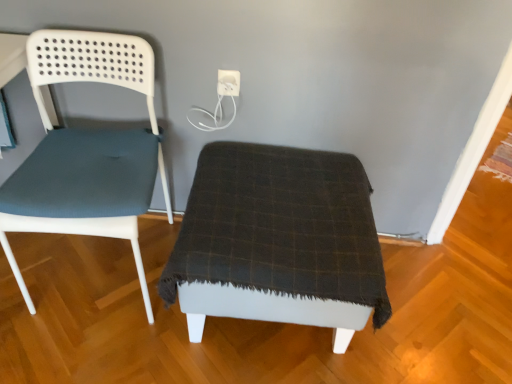
What do you see at coordinates (100, 207) in the screenshot?
I see `matte blue fabric chair at left` at bounding box center [100, 207].

What are the coordinates of `matte blue fabric chair at left` in the screenshot? It's located at (100, 207).

Measure the distance between point (x=225, y=90) and camera.

They are 1.34 meters apart.

Locate an element on the screen. The image size is (512, 384). matte blue fabric chair at left is located at coordinates (100, 207).

Which object is positioned more to the left, matte blue fabric chair at left or dark plaid fabric ottoman at center?

From the viewer's perspective, matte blue fabric chair at left appears more on the left side.

Based on their sizes in the image, would you say matte blue fabric chair at left is bigger or smaller than dark plaid fabric ottoman at center?

Clearly, matte blue fabric chair at left is smaller in size than dark plaid fabric ottoman at center.

Which object is more forward, matte blue fabric chair at left or dark plaid fabric ottoman at center?

matte blue fabric chair at left is closer to the camera.

Considering the sizes of matte blue fabric chair at left and dark plaid fabric ottoman at center in the image, is matte blue fabric chair at left taller or shorter than dark plaid fabric ottoman at center?

Clearly, matte blue fabric chair at left is taller compared to dark plaid fabric ottoman at center.

Is dark plaid fabric ottoman at center positioned with its back to matte blue fabric chair at left?

dark plaid fabric ottoman at center is not turned away from matte blue fabric chair at left.

Is dark plaid fabric ottoman at center wider than matte blue fabric chair at left?

Yes, dark plaid fabric ottoman at center is wider than matte blue fabric chair at left.

Who is taller, dark plaid fabric ottoman at center or matte blue fabric chair at left?

matte blue fabric chair at left.

Is matte blue fabric chair at left completely or partially inside dark plaid fabric ottoman at center?

Definitely not — matte blue fabric chair at left is not inside dark plaid fabric ottoman at center.

In terms of width, does white plastic electric outlet at upper center look wider or thinner when compared to dark plaid fabric ottoman at center?

white plastic electric outlet at upper center is thinner than dark plaid fabric ottoman at center.

Which of these two, white plastic electric outlet at upper center or dark plaid fabric ottoman at center, is smaller?

white plastic electric outlet at upper center.

In the scene shown: Is white plastic electric outlet at upper center turned away from dark plaid fabric ottoman at center?

No, white plastic electric outlet at upper center is not facing the opposite direction of dark plaid fabric ottoman at center.

From the image's perspective, is white plastic electric outlet at upper center above or below matte blue fabric chair at left?

white plastic electric outlet at upper center is above matte blue fabric chair at left.

Based on the photo, is matte blue fabric chair at left at the back of white plastic electric outlet at upper center?

No, white plastic electric outlet at upper center is not facing the opposite direction of matte blue fabric chair at left.

Can you tell me how much white plastic electric outlet at upper center and matte blue fabric chair at left differ in facing direction?

There is a 1.69-degree angle between the facing directions of white plastic electric outlet at upper center and matte blue fabric chair at left.

Consider the image. From their relative heights in the image, would you say white plastic electric outlet at upper center is taller or shorter than matte blue fabric chair at left?

white plastic electric outlet at upper center is shorter than matte blue fabric chair at left.

Considering their positions, is matte blue fabric chair at left located in front of or behind white plastic electric outlet at upper center?

Clearly, matte blue fabric chair at left is in front of white plastic electric outlet at upper center.

In the image, there is a white plastic electric outlet at upper center. In order to click on chair below it (from a real-world perspective) in this screenshot , I will do `click(100, 207)`.

Is dark plaid fabric ottoman at center not near white plastic electric outlet at upper center?

No, there isn't a large distance between dark plaid fabric ottoman at center and white plastic electric outlet at upper center.

Does dark plaid fabric ottoman at center have a lesser height compared to white plastic electric outlet at upper center?

Incorrect, the height of dark plaid fabric ottoman at center does not fall short of that of white plastic electric outlet at upper center.

Where is `electric outlet that is above the dark plaid fabric ottoman at center (from a real-world perspective)`? electric outlet that is above the dark plaid fabric ottoman at center (from a real-world perspective) is located at coordinates (228, 83).

Could you tell me if dark plaid fabric ottoman at center is facing white plastic electric outlet at upper center?

No, dark plaid fabric ottoman at center is not aimed at white plastic electric outlet at upper center.

Where is `furniture that is on the right side of matte blue fabric chair at left`? The height and width of the screenshot is (384, 512). furniture that is on the right side of matte blue fabric chair at left is located at coordinates (278, 241).

Where is `furniture below the matte blue fabric chair at left (from the image's perspective)`? This screenshot has width=512, height=384. furniture below the matte blue fabric chair at left (from the image's perspective) is located at coordinates (278, 241).

Considering their positions, is dark plaid fabric ottoman at center positioned closer to matte blue fabric chair at left than white plastic electric outlet at upper center?

Among the two, dark plaid fabric ottoman at center is located nearer to matte blue fabric chair at left.

Looking at the image, which one is located further to white plastic electric outlet at upper center, matte blue fabric chair at left or dark plaid fabric ottoman at center?

The object further to white plastic electric outlet at upper center is dark plaid fabric ottoman at center.

From the picture: Based on their spatial positions, is matte blue fabric chair at left or white plastic electric outlet at upper center closer to dark plaid fabric ottoman at center?

The object closer to dark plaid fabric ottoman at center is matte blue fabric chair at left.

From the image, which object appears to be farther from white plastic electric outlet at upper center, dark plaid fabric ottoman at center or matte blue fabric chair at left?

The object further to white plastic electric outlet at upper center is dark plaid fabric ottoman at center.

Looking at the image, which one is located further to dark plaid fabric ottoman at center, white plastic electric outlet at upper center or matte blue fabric chair at left?

white plastic electric outlet at upper center is further to dark plaid fabric ottoman at center.

Estimate the real-world distances between objects in this image. Which object is closer to matte blue fabric chair at left, white plastic electric outlet at upper center or dark plaid fabric ottoman at center?

dark plaid fabric ottoman at center is positioned closer to the anchor matte blue fabric chair at left.

Where is `electric outlet between matte blue fabric chair at left and dark plaid fabric ottoman at center from left to right`? This screenshot has height=384, width=512. electric outlet between matte blue fabric chair at left and dark plaid fabric ottoman at center from left to right is located at coordinates (228, 83).